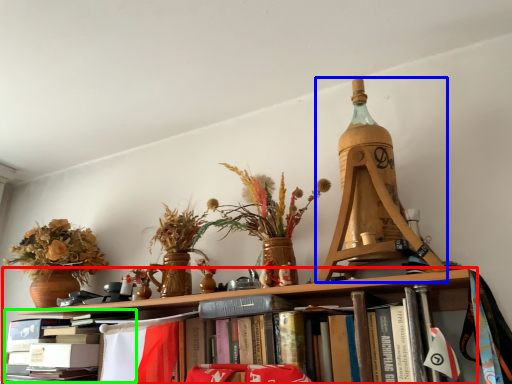
Question: Which object is positioned farthest from shelf (highlighted by a red box)? Select from Eiffel tower (highlighted by a blue box) and book (highlighted by a green box).

Choices:
 (A) Eiffel tower
 (B) book

Answer: (A)